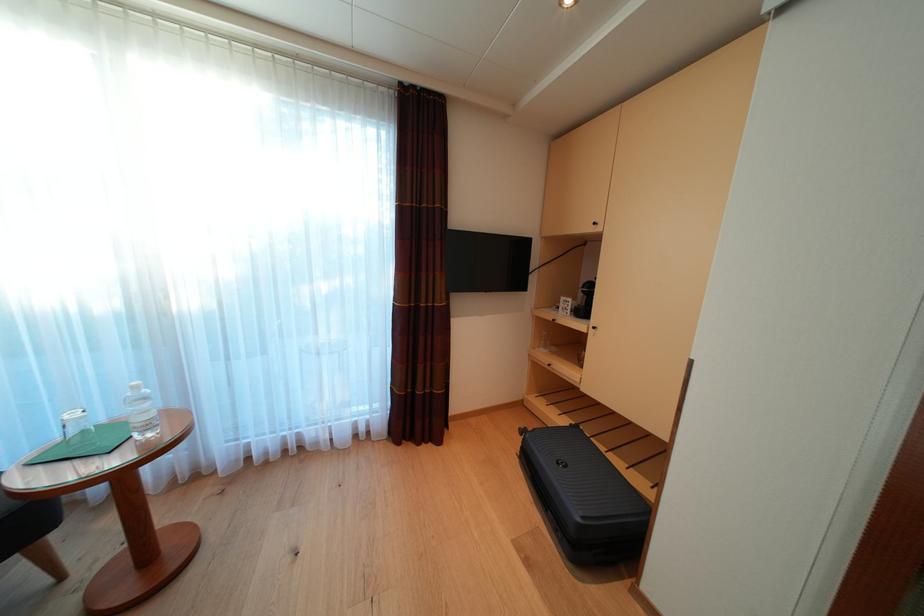
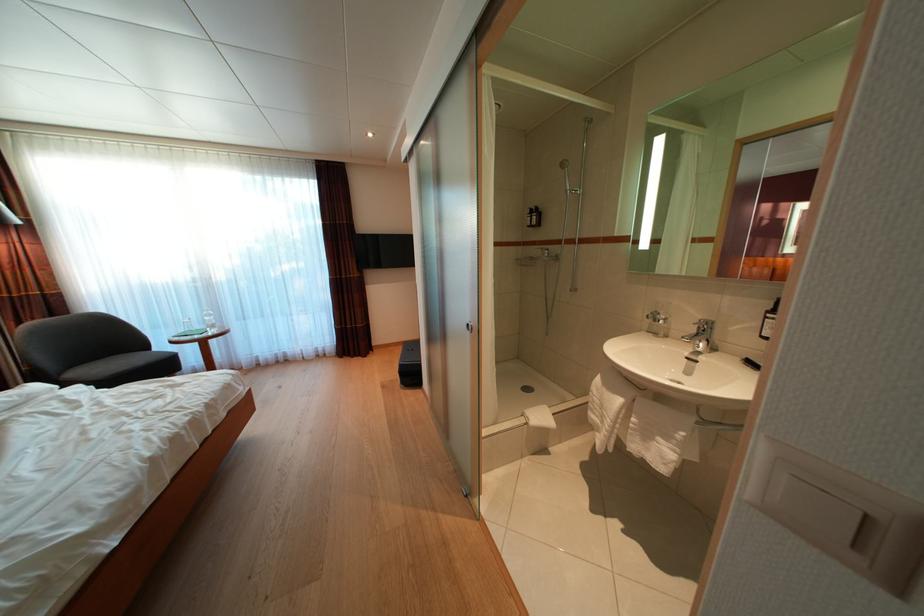
What movement of the cameraman would produce the second image?

The movement direction of the cameraman is right, backward.